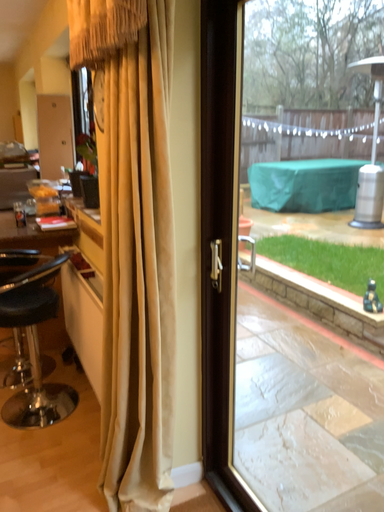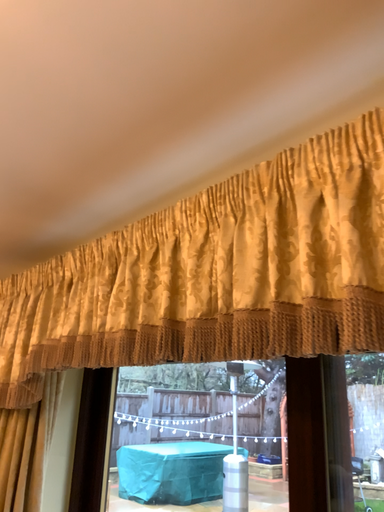
Question: Which way did the camera rotate in the video?

Choices:
 (A) rotated downward
 (B) rotated upward

Answer: (B)